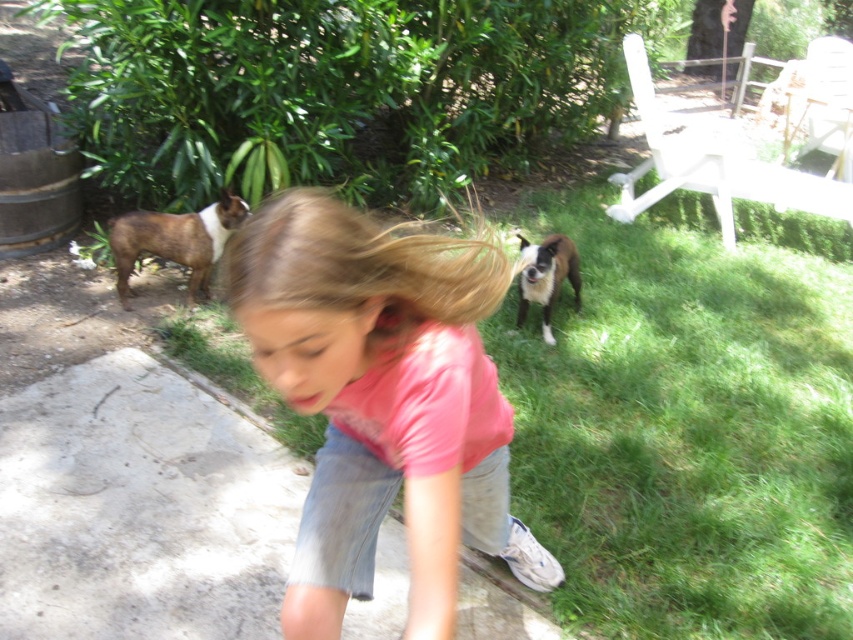
Is brown fur dog at left above brown fur dog at center?

Indeed, brown fur dog at left is positioned over brown fur dog at center.

Is brown fur dog at left to the right of brown fur dog at center from the viewer's perspective?

Incorrect, brown fur dog at left is not on the right side of brown fur dog at center.

Where is `brown fur dog at left`? The image size is (853, 640). brown fur dog at left is located at coordinates (175, 241).

Between pink cotton shirt at center and brown fur dog at left, which one is positioned higher?

brown fur dog at left is higher up.

Is point (306, 570) positioned before point (209, 250)?

Yes, it is in front of point (209, 250).

The height and width of the screenshot is (640, 853). I want to click on pink cotton shirt at center, so click(381, 401).

Which is above, white plastic chair at upper right or brown fur dog at left?

white plastic chair at upper right is higher up.

Is point (844, 212) in front of point (181, 237)?

No, it is behind (181, 237).

Identify the location of white plastic chair at upper right. tap(712, 166).